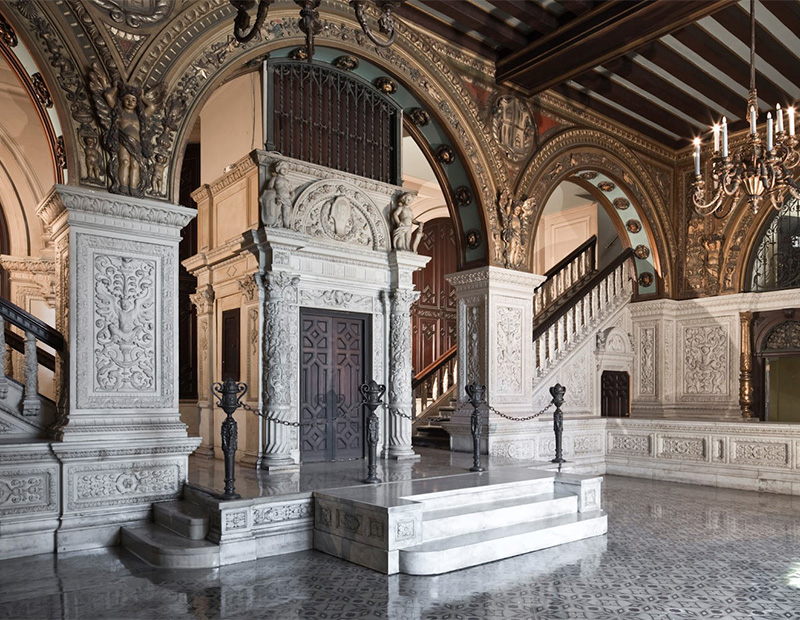
You are a GUI agent. You are given a task and a screenshot of the screen. Output one action in this format:
    pyautogui.click(x=<x>, y=<y>)
    Task: Click on the candle chandelier
    This screenshot has width=800, height=620.
    Given the screenshot: What is the action you would take?
    pyautogui.click(x=308, y=1), pyautogui.click(x=752, y=177)